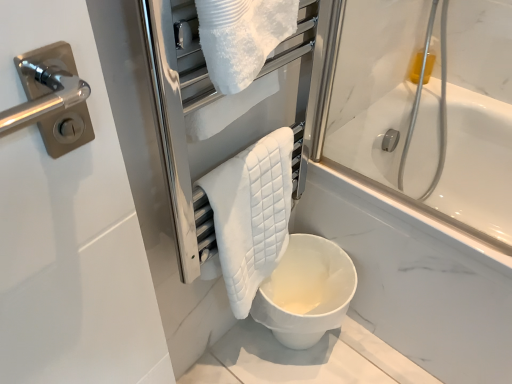
Locate an element on the screen. The image size is (512, 384). vacant area that is situated to the right of white matte toilet at lower center is located at coordinates (369, 356).